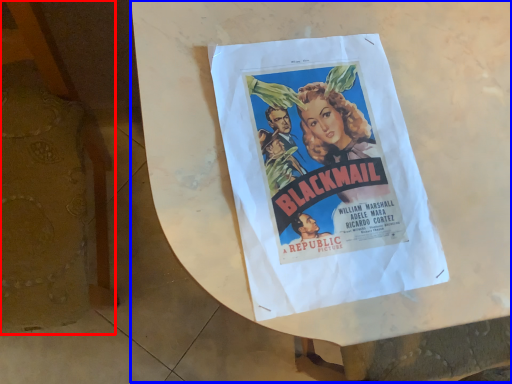
Question: Which point is further to the camera, furniture (highlighted by a red box) or round table (highlighted by a blue box)?

Choices:
 (A) furniture
 (B) round table

Answer: (B)